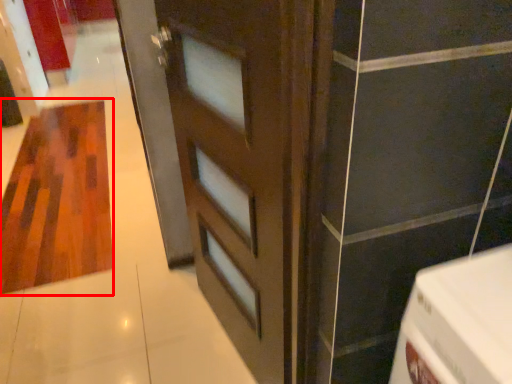
Question: From the image's perspective, what is the correct spatial positioning of hardwood (annotated by the red box) in reference to door?

Choices:
 (A) below
 (B) above

Answer: (B)